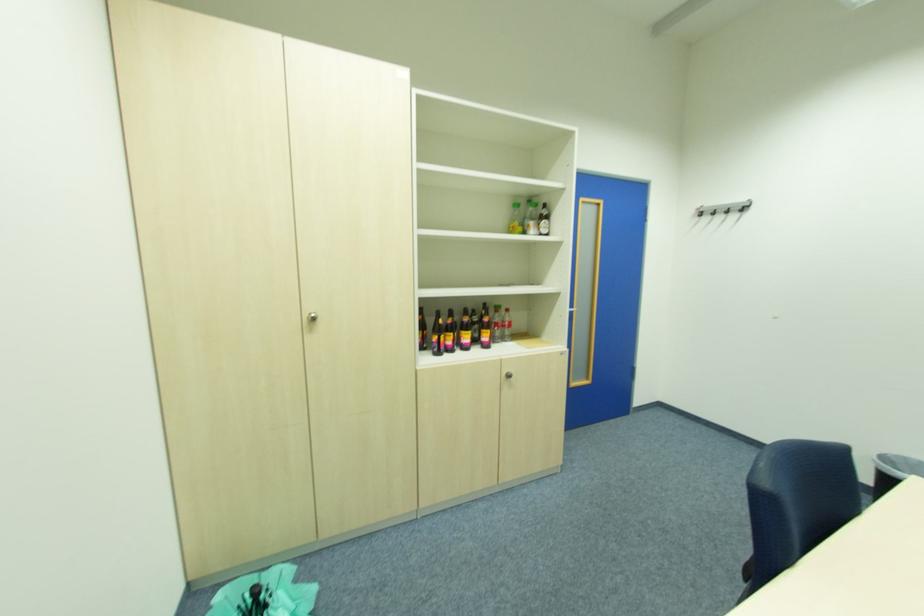
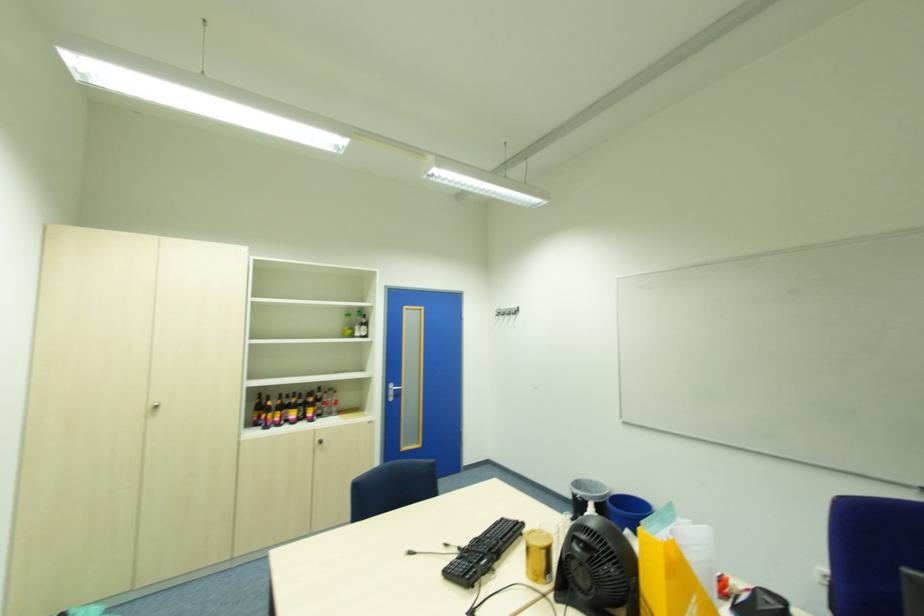
In a continuous first-person perspective shot, in which direction is the camera moving?

The cameraman walked toward right, backward.